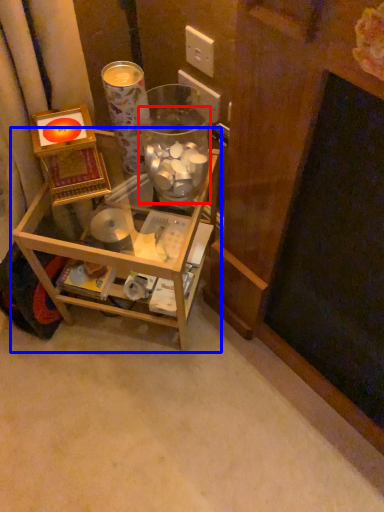
Question: Which point is closer to the camera, glass jar (highlighted by a red box) or furniture (highlighted by a blue box)?

Choices:
 (A) glass jar
 (B) furniture

Answer: (A)